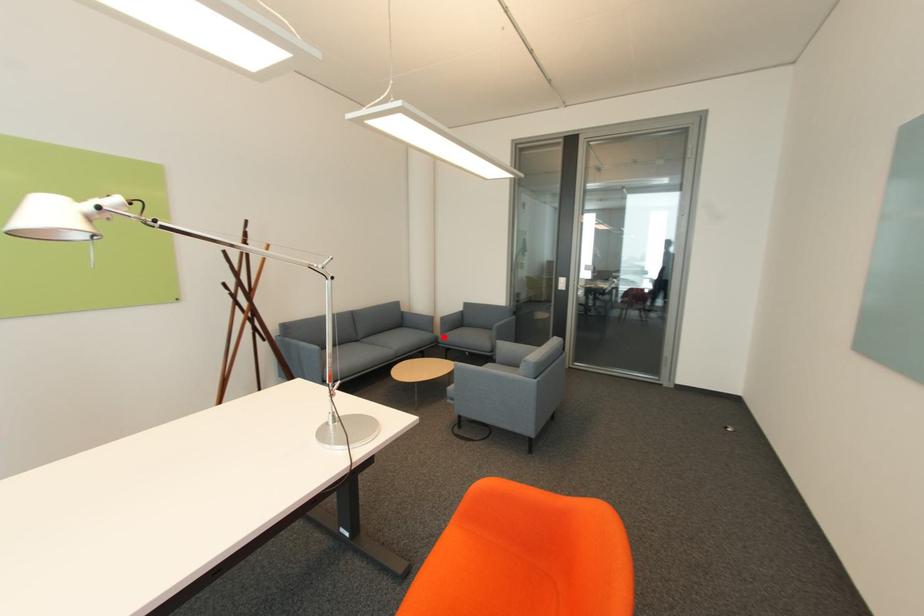
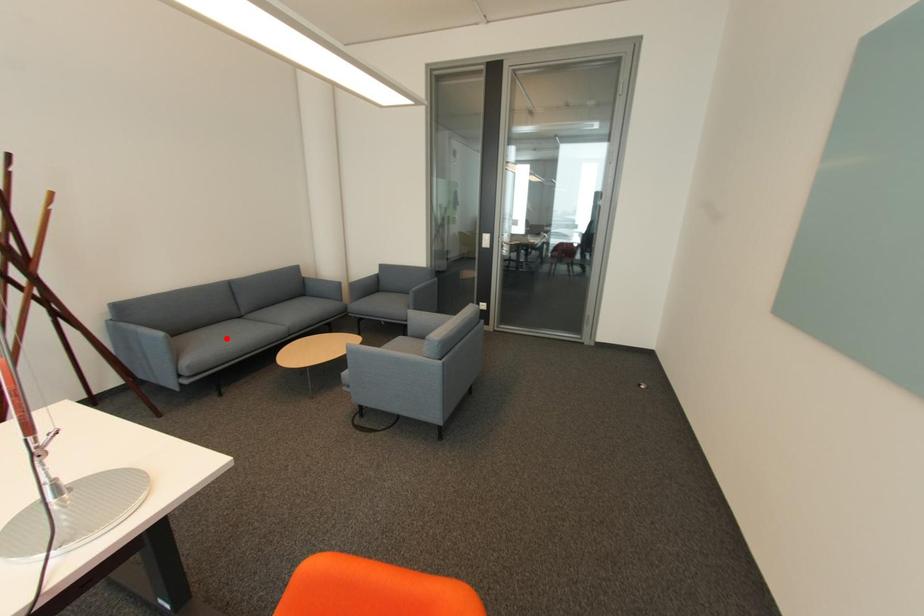
I am providing you with two images of the same scene from different viewpoints. A red point is marked on the first image and another point is marked on the second image. Are the points marked in image1 and image2 representing the same 3D position?

No